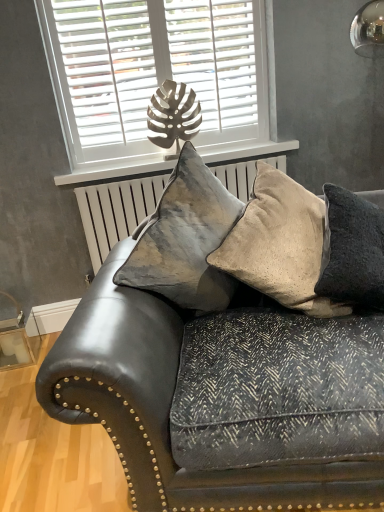
Locate an element on the screen. free point above white matte window sill at upper center (from a real-world perspective) is located at coordinates (171, 158).